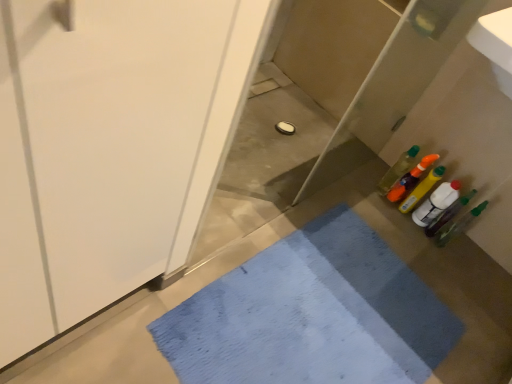
Describe the element at coordinates (410, 179) in the screenshot. I see `translucent orange bottle at right, placed as the fifth bottle when sorted from right to left` at that location.

Where is `translucent plastic bottles at right, which is the sixth bottle from right to left`? Image resolution: width=512 pixels, height=384 pixels. translucent plastic bottles at right, which is the sixth bottle from right to left is located at coordinates (398, 170).

The image size is (512, 384). What are the coordinates of `blue woven bath mat at lower center` in the screenshot? It's located at (312, 314).

The image size is (512, 384). Describe the element at coordinates (312, 314) in the screenshot. I see `blue woven bath mat at lower center` at that location.

Locate an element on the screen. This screenshot has width=512, height=384. translucent plastic bottle at right, which ranks as the fifth bottle in left-to-right order is located at coordinates (448, 214).

Measure the distance between point (486, 204) and camera.

Point (486, 204) and camera are 1.81 meters apart.

Find the location of `translucent plastic bottle at right, the third bottle from the left`. translucent plastic bottle at right, the third bottle from the left is located at coordinates click(x=421, y=189).

Between translucent plastic bottle at right, the second bottle when ordered from right to left, and translucent plastic bottles at right, which is the first bottle in left-to-right order, which one has less height?

With less height is translucent plastic bottle at right, the second bottle when ordered from right to left.

Could you tell me if translucent plastic bottle at right, which ranks as the fifth bottle in left-to-right order, is turned towards translucent plastic bottles at right, which is the sixth bottle from right to left?

No, translucent plastic bottle at right, which ranks as the fifth bottle in left-to-right order, does not turn towards translucent plastic bottles at right, which is the sixth bottle from right to left.

Which object is further away from the camera taking this photo, translucent plastic bottle at right, the second bottle when ordered from right to left, or translucent plastic bottles at right, which is the first bottle in left-to-right order?

translucent plastic bottles at right, which is the first bottle in left-to-right order, is further away from the camera.

Is translucent plastic bottle at right, which ranks as the fifth bottle in left-to-right order, to the left of translucent plastic bottles at right, which is the first bottle in left-to-right order, from the viewer's perspective?

No.

Considering the relative sizes of translucent plastic bottle at right, the third bottle in the right-to-left sequence, and translucent plastic bottles at right, which is the sixth bottle from right to left, in the image provided, is translucent plastic bottle at right, the third bottle in the right-to-left sequence, wider than translucent plastic bottles at right, which is the sixth bottle from right to left,?

In fact, translucent plastic bottle at right, the third bottle in the right-to-left sequence, might be narrower than translucent plastic bottles at right, which is the sixth bottle from right to left.

From the image's perspective, which is below, translucent plastic bottle at right, the fourth bottle in the left-to-right sequence, or translucent plastic bottles at right, which is the sixth bottle from right to left?

From the image's view, translucent plastic bottle at right, the fourth bottle in the left-to-right sequence, is below.

Can we say translucent plastic bottle at right, the fourth bottle in the left-to-right sequence, lies outside translucent plastic bottles at right, which is the sixth bottle from right to left?

Absolutely, translucent plastic bottle at right, the fourth bottle in the left-to-right sequence, is external to translucent plastic bottles at right, which is the sixth bottle from right to left.

Based on their sizes in the image, would you say translucent plastic bottle at right, marked as the sixth bottle in a left-to-right arrangement, is bigger or smaller than translucent plastic bottles at right, which is the first bottle in left-to-right order?

In the image, translucent plastic bottle at right, marked as the sixth bottle in a left-to-right arrangement, appears to be larger than translucent plastic bottles at right, which is the first bottle in left-to-right order.

From a real-world perspective, which object rests below the other?

translucent plastic bottle at right, the 1th bottle from the right.

Is translucent plastic bottle at right, marked as the sixth bottle in a left-to-right arrangement, wider than translucent plastic bottles at right, which is the sixth bottle from right to left?

Correct, the width of translucent plastic bottle at right, marked as the sixth bottle in a left-to-right arrangement, exceeds that of translucent plastic bottles at right, which is the sixth bottle from right to left.

From the picture: Considering their positions, is translucent plastic bottle at right, marked as the sixth bottle in a left-to-right arrangement, located in front of or behind translucent plastic bottles at right, which is the sixth bottle from right to left?

translucent plastic bottle at right, marked as the sixth bottle in a left-to-right arrangement, is in front of translucent plastic bottles at right, which is the sixth bottle from right to left.

Is translucent plastic bottle at right, the 1th bottle from the right, at the back of translucent plastic bottle at right, the third bottle from the left?

That's not correct — translucent plastic bottle at right, the third bottle from the left, is not looking away from translucent plastic bottle at right, the 1th bottle from the right.

Which object is further away from the camera, translucent plastic bottle at right, the third bottle from the left, or translucent plastic bottle at right, the 1th bottle from the right?

Positioned behind is translucent plastic bottle at right, the third bottle from the left.

Which of these two, translucent plastic bottle at right, the third bottle from the left, or translucent plastic bottle at right, marked as the sixth bottle in a left-to-right arrangement, stands shorter?

→ With less height is translucent plastic bottle at right, marked as the sixth bottle in a left-to-right arrangement.

Between translucent plastic bottles at right, which is the sixth bottle from right to left, and translucent plastic bottle at right, the third bottle from the left, which one is positioned in front?

translucent plastic bottle at right, the third bottle from the left, is more forward.

Considering the relative positions of translucent plastic bottles at right, which is the sixth bottle from right to left, and translucent plastic bottle at right, the fourth bottle viewed from the right, in the image provided, is translucent plastic bottles at right, which is the sixth bottle from right to left, to the left of translucent plastic bottle at right, the fourth bottle viewed from the right, from the viewer's perspective?

Correct, you'll find translucent plastic bottles at right, which is the sixth bottle from right to left, to the left of translucent plastic bottle at right, the fourth bottle viewed from the right.

Is translucent plastic bottles at right, which is the first bottle in left-to-right order, looking in the opposite direction of translucent plastic bottle at right, the third bottle from the left?

No, translucent plastic bottles at right, which is the first bottle in left-to-right order, is not facing away from translucent plastic bottle at right, the third bottle from the left.

Which bottle is the 1st one when counting from the front of the translucent plastic bottle at right, the fourth bottle viewed from the right? Please provide its 2D coordinates.

[(436, 203)]

Is translucent plastic bottle at right, the fourth bottle viewed from the right, shorter than translucent plastic bottle at right, the fourth bottle in the left-to-right sequence?

No.

Can you tell me how much translucent plastic bottle at right, the fourth bottle viewed from the right, and translucent plastic bottle at right, the third bottle in the right-to-left sequence, differ in facing direction?

translucent plastic bottle at right, the fourth bottle viewed from the right, and translucent plastic bottle at right, the third bottle in the right-to-left sequence, are facing 0.00041 degrees away from each other.

Is translucent plastic bottle at right, the fourth bottle viewed from the right, positioned beyond the bounds of translucent plastic bottle at right, the fourth bottle in the left-to-right sequence?

Absolutely, translucent plastic bottle at right, the fourth bottle viewed from the right, is external to translucent plastic bottle at right, the fourth bottle in the left-to-right sequence.

Does point (450, 239) appear closer or farther from the camera than point (451, 185)?

Point (450, 239).

Where is `the 2nd bottle to the left when counting from the translucent plastic bottle at right, the 1th bottle from the right`? This screenshot has width=512, height=384. the 2nd bottle to the left when counting from the translucent plastic bottle at right, the 1th bottle from the right is located at coordinates (436, 203).

In order to click on bottle that is the 4th object located in front of the translucent plastic bottles at right, which is the first bottle in left-to-right order in this screenshot , I will do `click(448, 214)`.

At what (x,y) coordinates should I click in order to perform the action: click on bottle that is the 5th object directly below the translucent plastic bottles at right, which is the first bottle in left-to-right order (from a real-world perspective). Please return your answer as a coordinate pair (x, y). Image resolution: width=512 pixels, height=384 pixels. Looking at the image, I should click on (436, 203).

Considering their positions, is translucent plastic bottle at right, the third bottle from the left, positioned further to blue woven bath mat at lower center than translucent plastic bottle at right, the third bottle in the right-to-left sequence?

translucent plastic bottle at right, the third bottle from the left.

Which object lies further to the anchor point translucent plastic bottle at right, which ranks as the fifth bottle in left-to-right order, translucent plastic bottle at right, the third bottle in the right-to-left sequence, or translucent orange bottle at right, placed as the fifth bottle when sorted from right to left?

translucent orange bottle at right, placed as the fifth bottle when sorted from right to left.

Based on their spatial positions, is translucent orange bottle at right, placed as the fifth bottle when sorted from right to left, or translucent plastic bottle at right, the 1th bottle from the right, closer to translucent plastic bottles at right, which is the sixth bottle from right to left?

translucent orange bottle at right, placed as the fifth bottle when sorted from right to left, lies closer to translucent plastic bottles at right, which is the sixth bottle from right to left, than the other object.

Considering their positions, is translucent plastic bottle at right, the 1th bottle from the right, positioned further to translucent plastic bottle at right, the third bottle from the left, than translucent plastic bottles at right, which is the first bottle in left-to-right order?

translucent plastic bottle at right, the 1th bottle from the right, lies further to translucent plastic bottle at right, the third bottle from the left, than the other object.

From the image, which object appears to be nearer to translucent plastic bottle at right, the fourth bottle viewed from the right, translucent orange bottle at right, acting as the 2th bottle starting from the left, or translucent plastic bottle at right, marked as the sixth bottle in a left-to-right arrangement?

translucent orange bottle at right, acting as the 2th bottle starting from the left.

Which object lies nearer to the anchor point blue woven bath mat at lower center, translucent plastic bottle at right, the second bottle when ordered from right to left, or translucent plastic bottles at right, which is the sixth bottle from right to left?

translucent plastic bottle at right, the second bottle when ordered from right to left, lies closer to blue woven bath mat at lower center than the other object.

When comparing their distances from blue woven bath mat at lower center, does translucent plastic bottle at right, the 1th bottle from the right, or translucent orange bottle at right, acting as the 2th bottle starting from the left, seem closer?

translucent plastic bottle at right, the 1th bottle from the right, lies closer to blue woven bath mat at lower center than the other object.

Based on their spatial positions, is translucent plastic bottles at right, which is the first bottle in left-to-right order, or translucent orange bottle at right, placed as the fifth bottle when sorted from right to left, further from translucent plastic bottle at right, the fourth bottle in the left-to-right sequence?

translucent plastic bottles at right, which is the first bottle in left-to-right order, is further to translucent plastic bottle at right, the fourth bottle in the left-to-right sequence.

Identify the location of bottle between translucent orange bottle at right, placed as the fifth bottle when sorted from right to left, and translucent plastic bottle at right, the fourth bottle in the left-to-right sequence, from top to bottom. This screenshot has width=512, height=384. (421, 189).

Image resolution: width=512 pixels, height=384 pixels. What are the coordinates of `bottle between translucent plastic bottles at right, which is the first bottle in left-to-right order, and translucent plastic bottle at right, the fourth bottle viewed from the right` in the screenshot? It's located at (410, 179).

This screenshot has height=384, width=512. In order to click on bottle between blue woven bath mat at lower center and translucent plastic bottle at right, the second bottle when ordered from right to left, in the front-back direction in this screenshot , I will do `click(459, 225)`.

Locate an element on the screen. The image size is (512, 384). bottle between translucent plastic bottle at right, the fourth bottle viewed from the right, and translucent plastic bottle at right, the second bottle when ordered from right to left, in the vertical direction is located at coordinates (436, 203).